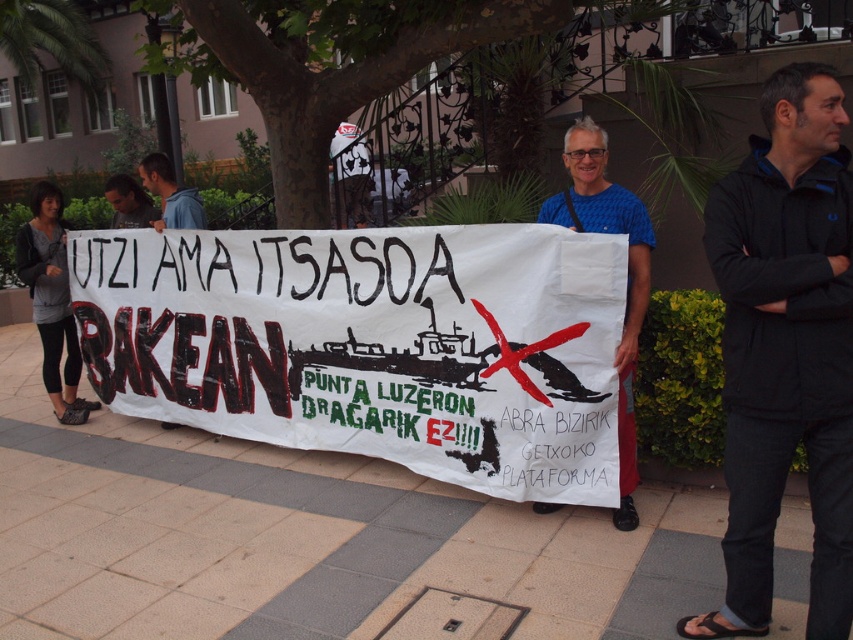
You are a photographer standing at the center of the protest area. You want to take a photo that includes both the white paper banner at center and the dark blue hoodie at upper left. Given that your camera has a maximum focal length that allows capturing objects up to 1.6 meters apart, will you be able to include both in the frame?

The white paper banner at center and dark blue hoodie at upper left are 1.68 meters apart from each other. Since the maximum distance your camera can capture is 1.6 meters, you will not be able to include both in the frame as the distance exceeds the camera limit.

Based on the scene description and the objects provided, what is the exact coordinate of the white paper banner at center?

The white paper banner at center is located at coordinate point (x=370, y=344).